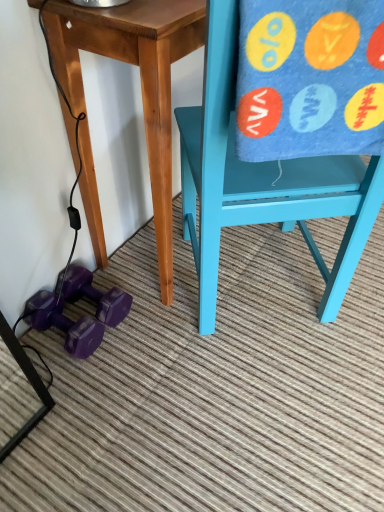
I want to click on vacant space in between wooden table at center and purple rubber dumbbell at lower left, which is the 2th dumbbell in bottom-to-top order, so click(132, 312).